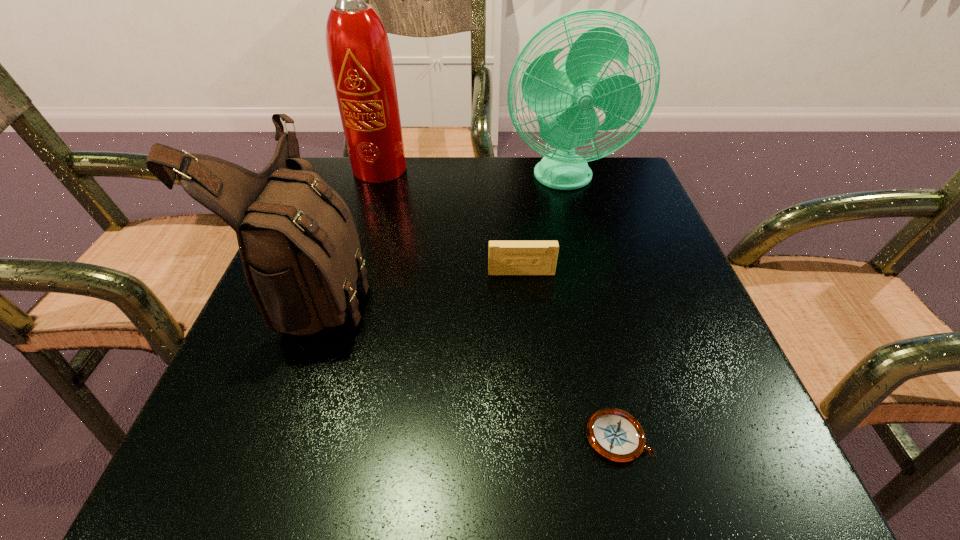
What are the coordinates of `free space that satisfies the following two spatial constraints: 1. in front of the fan to blow air; 2. on the front-facing side of the shoulder bag` in the screenshot? It's located at (591, 284).

The image size is (960, 540). I want to click on vacant area in the image that satisfies the following two spatial constraints: 1. in front of the fan to blow air; 2. on the front-facing side of the shoulder bag, so click(591, 284).

In order to click on blank space that satisfies the following two spatial constraints: 1. at the front of the videotape with spools; 2. on the front-facing side of the shoulder bag in this screenshot , I will do `click(522, 284)`.

At what (x,y) coordinates should I click in order to perform the action: click on vacant point that satisfies the following two spatial constraints: 1. in front of the fan to blow air; 2. on the front-facing side of the shoulder bag. Please return your answer as a coordinate pair (x, y). Looking at the image, I should click on (591, 284).